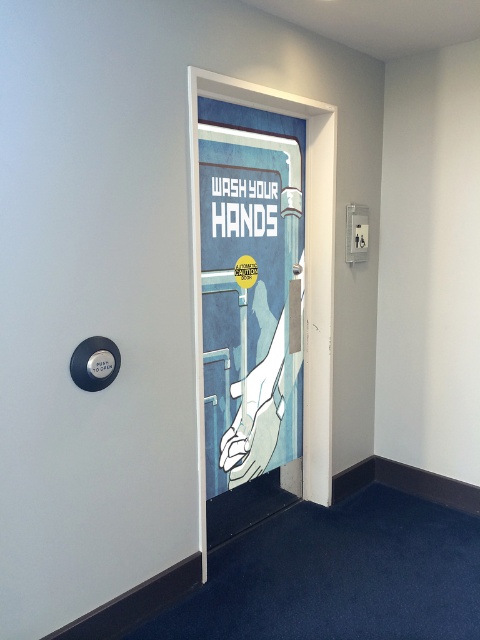
Question: Which point appears farthest from the camera in this image?

Choices:
 (A) (159, 349)
 (B) (240, 436)

Answer: (B)

Question: Can you confirm if white glossy door at center is positioned below blue paper poster at center?

Choices:
 (A) no
 (B) yes

Answer: (B)

Question: Does white glossy door at center appear under blue paper poster at center?

Choices:
 (A) no
 (B) yes

Answer: (B)

Question: Which object is farther from the camera taking this photo?

Choices:
 (A) white glossy door at center
 (B) blue paper poster at center

Answer: (B)

Question: Considering the relative positions of white glossy door at center and blue paper poster at center in the image provided, where is white glossy door at center located with respect to blue paper poster at center?

Choices:
 (A) above
 (B) below

Answer: (B)